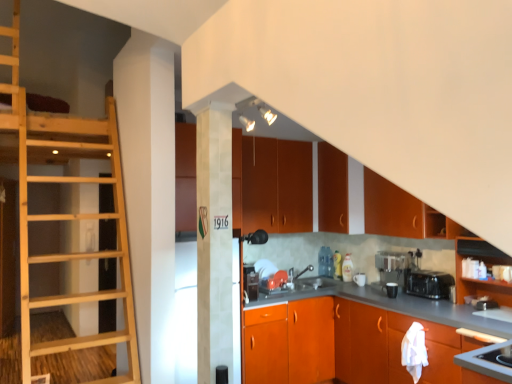
This screenshot has height=384, width=512. In order to click on free space that is to the left of matte black coffee maker at lower center, which is the fourth appliance in front-to-back order in this screenshot , I will do `click(375, 297)`.